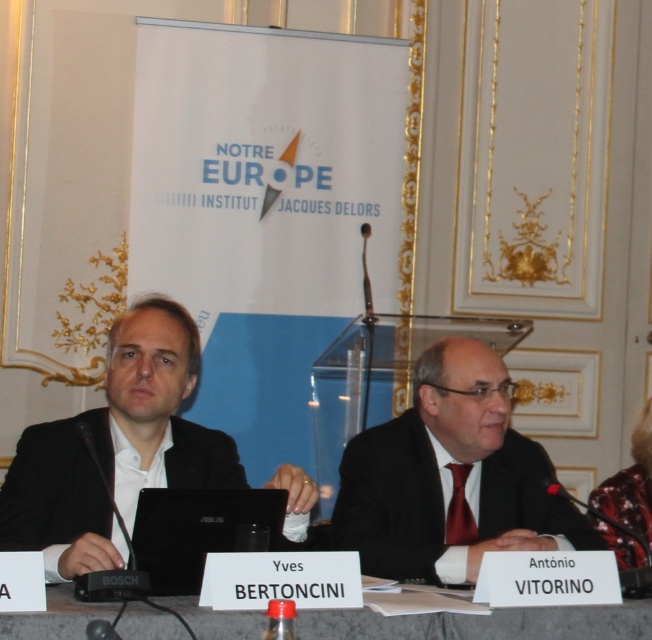
Which is more to the right, white paper at center or floral silk blouse at right?

From the viewer's perspective, floral silk blouse at right appears more on the right side.

Who is lower down, white paper at center or floral silk blouse at right?

white paper at center is lower down.

Locate an element on the screen. white paper at center is located at coordinates (482, 621).

Where is `white paper at center`? Image resolution: width=652 pixels, height=640 pixels. white paper at center is located at coordinates (482, 621).

Can you confirm if black suit at center is positioned below floral silk blouse at right?

Actually, black suit at center is above floral silk blouse at right.

Between black suit at center and floral silk blouse at right, which one is positioned lower?

floral silk blouse at right

Does point (520, 529) come behind point (612, 499)?

No, (520, 529) is in front of (612, 499).

Identify the location of black suit at center. (451, 477).

Who is positioned more to the right, black suit at center or white paper at center?

Positioned to the right is black suit at center.

Between point (451, 524) and point (593, 625), which one is positioned in front?

Positioned in front is point (593, 625).

Which is behind, point (381, 554) or point (604, 621)?

The point (381, 554) is behind.

The image size is (652, 640). In order to click on black suit at center in this screenshot , I will do `click(451, 477)`.